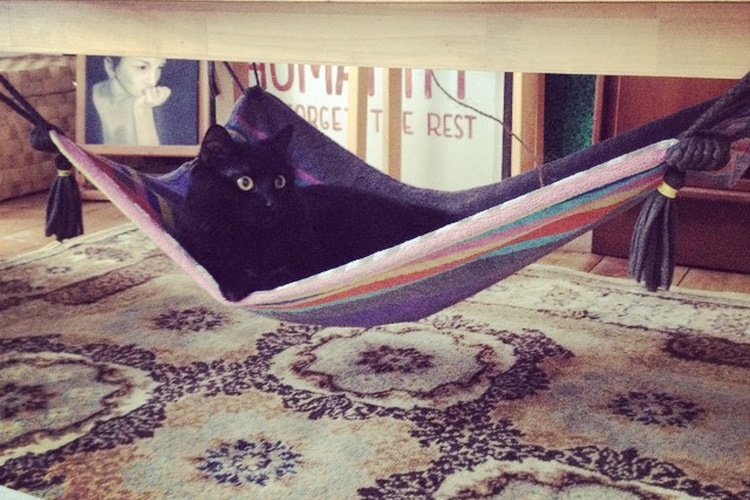
Identify the location of tassle. This screenshot has height=500, width=750. (61, 208).